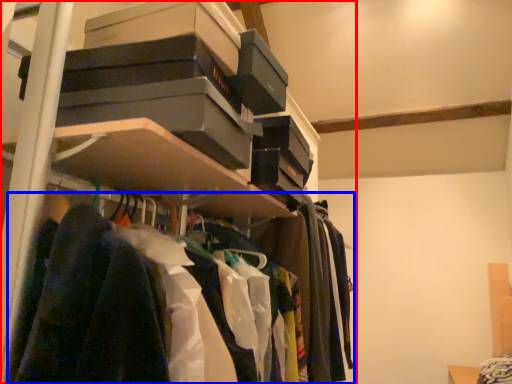
Question: Which object is closer to the camera taking this photo, shelf (highlighted by a red box) or clothing (highlighted by a blue box)?

Choices:
 (A) shelf
 (B) clothing

Answer: (B)